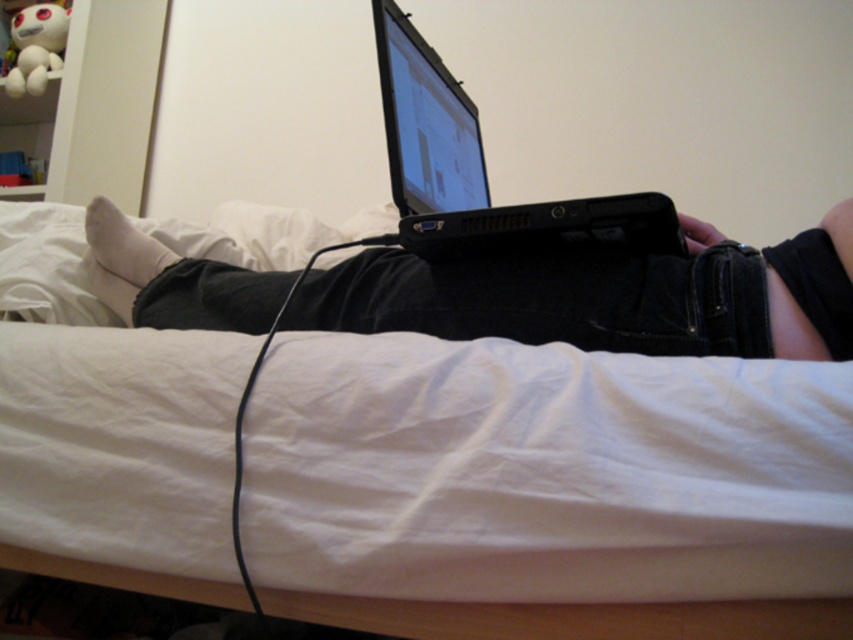
You are a delivery robot trying to place a package on the bed. The package is 10 inches long. Can you place the package between the white fabric bed at center and the black matte laptop at center without moving the laptop?

The white fabric bed at center and the black matte laptop at center are 9.00 inches apart, so the package which is 10 inches long cannot fit between them since it is longer than the available space.

You are a delivery robot entering the room. You need to place a package on the shelf where the small plush toy with red eyes is located. The coordinates of the shelf are given as a reference point. Can you determine if the black matte laptop at center is blocking the path to the shelf?

The black matte laptop at center is located at point [608,298]. Since the shelf is on the left side of the frame and the laptop is at the center, the laptop might be blocking the path to the shelf depending on the exact coordinates of the shelf. However, without knowing the shelf coordinates, it is impossible to determine if the laptop is blocking the path.

You are setting up a desk in your room and need to place two laptops. You have a black matte laptop at center and a black plastic laptop at center. According to the scene, which one is positioned to the left?

The black matte laptop at center is positioned to the left of the black plastic laptop at center.